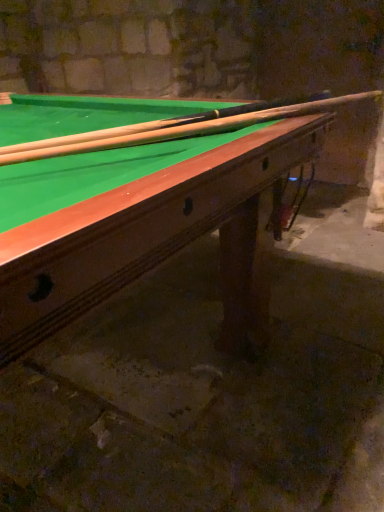
Question: Is point (281, 104) closer or farther from the camera than point (160, 144)?

Choices:
 (A) closer
 (B) farther

Answer: (B)

Question: Relative to green felt billiard table at upper center, is wooden cue at upper center in front or behind?

Choices:
 (A) behind
 (B) front

Answer: (A)

Question: Is wooden cue at upper center taller or shorter than green felt billiard table at upper center?

Choices:
 (A) short
 (B) tall

Answer: (A)

Question: Considering the positions of green felt billiard table at upper center and wooden cue at upper center in the image, is green felt billiard table at upper center bigger or smaller than wooden cue at upper center?

Choices:
 (A) small
 (B) big

Answer: (B)

Question: Considering the positions of green felt billiard table at upper center and wooden cue at upper center in the image, is green felt billiard table at upper center wider or thinner than wooden cue at upper center?

Choices:
 (A) wide
 (B) thin

Answer: (A)

Question: Is green felt billiard table at upper center taller or shorter than wooden cue at upper center?

Choices:
 (A) tall
 (B) short

Answer: (A)

Question: Considering the relative positions of green felt billiard table at upper center and wooden cue at upper center in the image provided, is green felt billiard table at upper center to the left or to the right of wooden cue at upper center?

Choices:
 (A) right
 (B) left

Answer: (B)